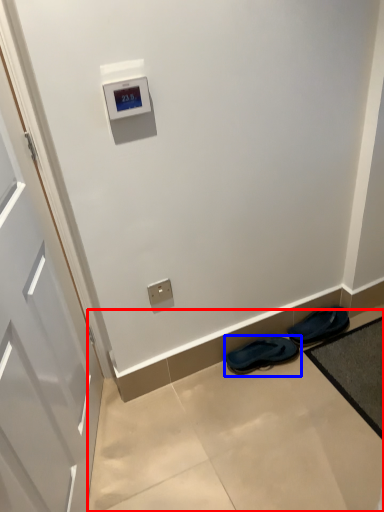
Question: Among these objects, which one is farthest to the camera, concrete (highlighted by a red box) or footwear (highlighted by a blue box)?

Choices:
 (A) concrete
 (B) footwear

Answer: (B)